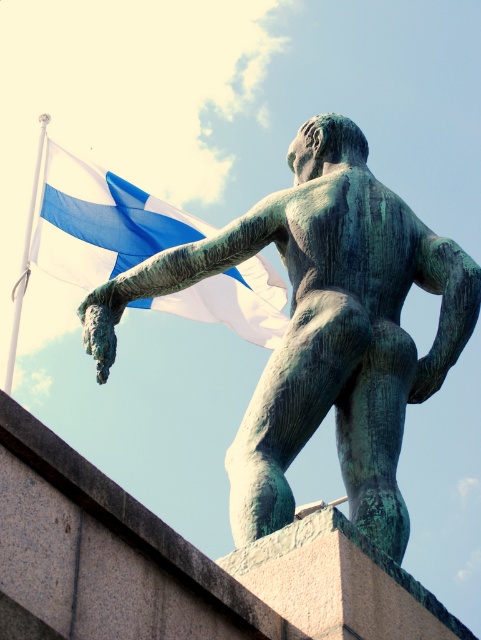
Consider the image. You are a photographer planning to capture the statue and the flag in a single frame. Given that the green patina statue at center and the blue fabric flag at upper left are both in your shot, which object would you need to adjust your focus settings for if you want to ensure both are in sharp focus, considering their sizes?

The green patina statue at center has a smaller size compared to blue fabric flag at upper left, so you should focus on the smaller object to ensure both are in sharp focus.

Consider the image. You are a city planner checking the distance between the green patina statue at center and the blue fabric flag at upper left. According to the city regulations, these two landmarks must be at least 70 feet apart for safety. Does the current distance meet the requirement?

The green patina statue at center and blue fabric flag at upper left are 71.49 feet apart, which exceeds the minimum required distance of 70 feet. Therefore, the current distance meets the safety requirement.

You are a photographer standing at a certain distance from the green patina statue at center. You want to capture a full view of the statue without any cropping. Your camera has a standard lens with a focal length of 50mm. According to the rule of thumb, the minimum distance required to fully frame a statue that is 3 meters tall using this lens is approximately 4.6 meters. Considering the distance between you and the statue, will your current position allow you to capture the statue in full without cropping

The green patina statue at center and camera are 49.36 meters apart from each other. Since the minimum required distance is 4.6 meters and you are much farther away, your current position will not allow capturing the statue in full without cropping. You need to move closer to within 4.6 meters.